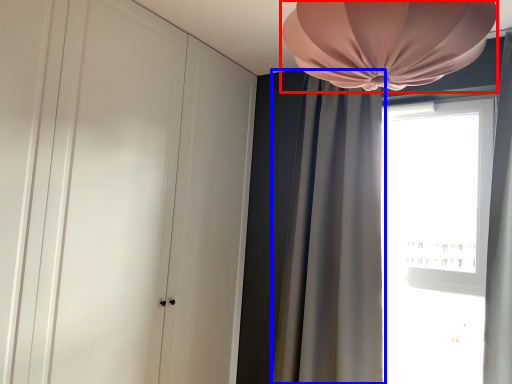
Question: Which of the following is the farthest to the observer, lamp (highlighted by a red box) or curtain (highlighted by a blue box)?

Choices:
 (A) lamp
 (B) curtain

Answer: (B)